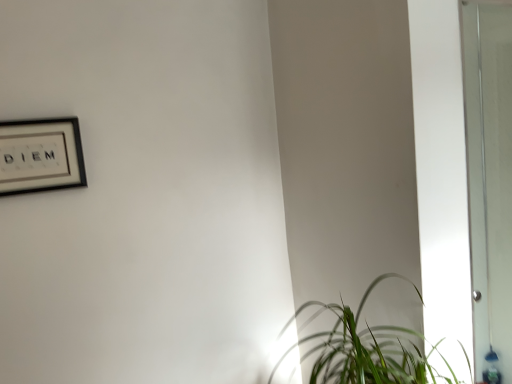
Find the location of a particular element. Image resolution: width=512 pixels, height=384 pixels. black matte picture frame at upper left is located at coordinates (40, 155).

What do you see at coordinates (40, 155) in the screenshot? The width and height of the screenshot is (512, 384). I see `black matte picture frame at upper left` at bounding box center [40, 155].

Find the location of a particular element. This screenshot has height=384, width=512. green leafy plant at lower right is located at coordinates (366, 349).

Image resolution: width=512 pixels, height=384 pixels. Describe the element at coordinates (366, 349) in the screenshot. I see `green leafy plant at lower right` at that location.

Identify the location of black matte picture frame at upper left. (40, 155).

Between green leafy plant at lower right and black matte picture frame at upper left, which one appears on the right side from the viewer's perspective?

Positioned to the right is green leafy plant at lower right.

Which is in front, green leafy plant at lower right or black matte picture frame at upper left?

green leafy plant at lower right is in front.

Which is in front, point (403, 363) or point (14, 188)?

The point (403, 363) is more forward.

From the image's perspective, which one is positioned higher, green leafy plant at lower right or black matte picture frame at upper left?

black matte picture frame at upper left.

Based on the photo, from a real-world perspective, is green leafy plant at lower right on black matte picture frame at upper left?

No, from a real-world perspective, green leafy plant at lower right is not over black matte picture frame at upper left

In terms of width, does green leafy plant at lower right look wider or thinner when compared to black matte picture frame at upper left?

green leafy plant at lower right is wider than black matte picture frame at upper left.

Between green leafy plant at lower right and black matte picture frame at upper left, which one has more height?

green leafy plant at lower right is taller.

Considering the sizes of green leafy plant at lower right and black matte picture frame at upper left in the image, is green leafy plant at lower right bigger or smaller than black matte picture frame at upper left?

green leafy plant at lower right is bigger than black matte picture frame at upper left.

Would you say green leafy plant at lower right contains black matte picture frame at upper left?

No, black matte picture frame at upper left is not surrounded by green leafy plant at lower right.

Are green leafy plant at lower right and black matte picture frame at upper left beside each other?

No, green leafy plant at lower right is not in contact with black matte picture frame at upper left.

Is green leafy plant at lower right looking in the opposite direction of black matte picture frame at upper left?

That's not correct — green leafy plant at lower right is not looking away from black matte picture frame at upper left.

Measure the distance from green leafy plant at lower right to black matte picture frame at upper left.

A distance of 1.05 meters exists between green leafy plant at lower right and black matte picture frame at upper left.

Image resolution: width=512 pixels, height=384 pixels. I want to click on picture frame behind the green leafy plant at lower right, so (40, 155).

Between black matte picture frame at upper left and green leafy plant at lower right, which one appears on the right side from the viewer's perspective?

Positioned to the right is green leafy plant at lower right.

Is black matte picture frame at upper left positioned in front of green leafy plant at lower right?

No, it is not.

Which is farther from the camera, (35, 182) or (403, 377)?

The point (35, 182) is farther.

From the image's perspective, is black matte picture frame at upper left on green leafy plant at lower right?

Yes, from the image's perspective, black matte picture frame at upper left is on top of green leafy plant at lower right.

From a real-world perspective, is black matte picture frame at upper left above or below green leafy plant at lower right?

In terms of real-world spatial position, black matte picture frame at upper left is above green leafy plant at lower right.

Does black matte picture frame at upper left have a lesser width compared to green leafy plant at lower right?

Indeed, black matte picture frame at upper left has a lesser width compared to green leafy plant at lower right.

From their relative heights in the image, would you say black matte picture frame at upper left is taller or shorter than green leafy plant at lower right?

Clearly, black matte picture frame at upper left is shorter compared to green leafy plant at lower right.

Does black matte picture frame at upper left have a smaller size compared to green leafy plant at lower right?

Yes, black matte picture frame at upper left is smaller than green leafy plant at lower right.

Is black matte picture frame at upper left located outside green leafy plant at lower right?

Indeed, black matte picture frame at upper left is completely outside green leafy plant at lower right.

Are black matte picture frame at upper left and green leafy plant at lower right making contact?

No.

Is black matte picture frame at upper left turned away from green leafy plant at lower right?

That's not correct — black matte picture frame at upper left is not looking away from green leafy plant at lower right.

Identify the location of houseplant lying on the right of black matte picture frame at upper left. The image size is (512, 384). (366, 349).

I want to click on houseplant that is below the black matte picture frame at upper left (from the image's perspective), so click(x=366, y=349).

This screenshot has height=384, width=512. I want to click on picture frame on the left of green leafy plant at lower right, so click(x=40, y=155).